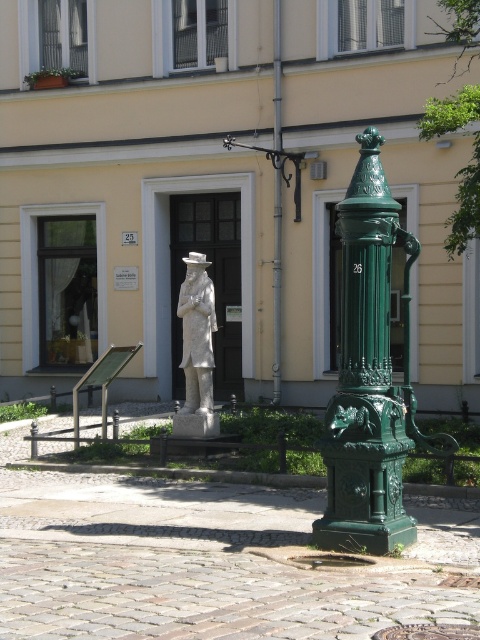
Question: Which point is farther to the camera?

Choices:
 (A) green metal pole at upper center
 (B) white stone statue at center

Answer: (A)

Question: Can you confirm if white stone statue at center is smaller than green cast iron lamp post at center?

Choices:
 (A) no
 (B) yes

Answer: (B)

Question: Can you confirm if white stone statue at center is wider than green cast iron lamp post at center?

Choices:
 (A) no
 (B) yes

Answer: (A)

Question: Can you confirm if green metal pole at upper center is positioned above green cast iron lamp post at center?

Choices:
 (A) no
 (B) yes

Answer: (A)

Question: Which object is closer to the camera taking this photo?

Choices:
 (A) white stone statue at center
 (B) green metal pole at upper center
 (C) green cast iron lamp post at center

Answer: (A)

Question: Which point is farther to the camera?

Choices:
 (A) green metal pole at upper center
 (B) green cast iron lamp post at center

Answer: (A)